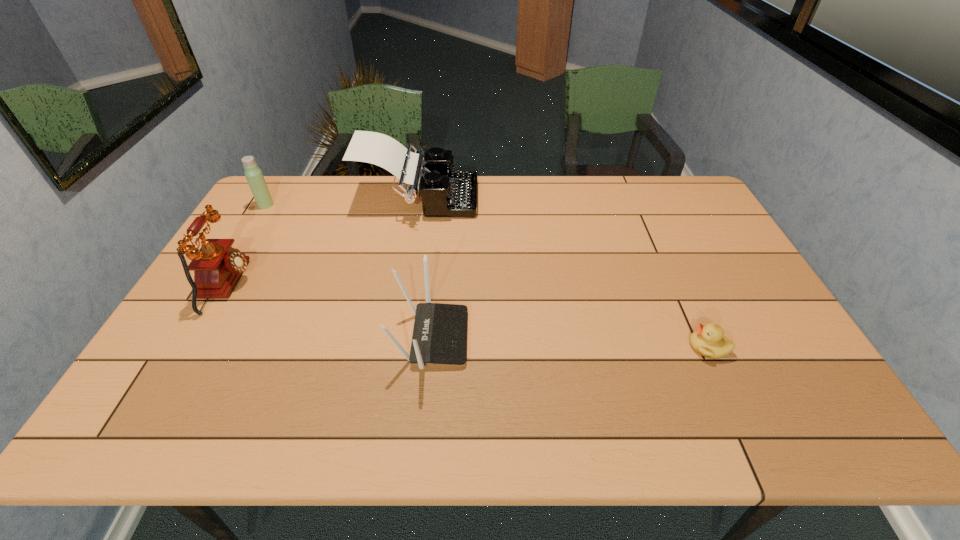
This screenshot has height=540, width=960. I want to click on blank space located 0.140m on the beak of the duckling, so click(633, 347).

Identify the location of vacant region located on the beak of the duckling. The width and height of the screenshot is (960, 540). (547, 347).

This screenshot has width=960, height=540. Identify the location of vacant space located 0.210m on the beak of the duckling. (604, 347).

Find the location of `typewriter present at the far edge`. typewriter present at the far edge is located at coordinates (445, 193).

I want to click on thermos bottle located at the far edge, so click(254, 176).

Where is `telephone situated at the left edge`? telephone situated at the left edge is located at coordinates (217, 266).

The image size is (960, 540). What are the coordinates of `thermos bottle that is at the left edge` in the screenshot? It's located at (254, 176).

Find the location of `object located at the far left corner`. object located at the far left corner is located at coordinates (254, 176).

You are a GUI agent. You are given a task and a screenshot of the screen. Output one action in this format:
    pyautogui.click(x=<x>, y=<y>)
    Task: Click on the blank space at the far edge
    
    Given the screenshot: What is the action you would take?
    pyautogui.click(x=350, y=197)

Image resolution: width=960 pixels, height=540 pixels. Find the location of `free space at the near edge of the desktop`. free space at the near edge of the desktop is located at coordinates (755, 406).